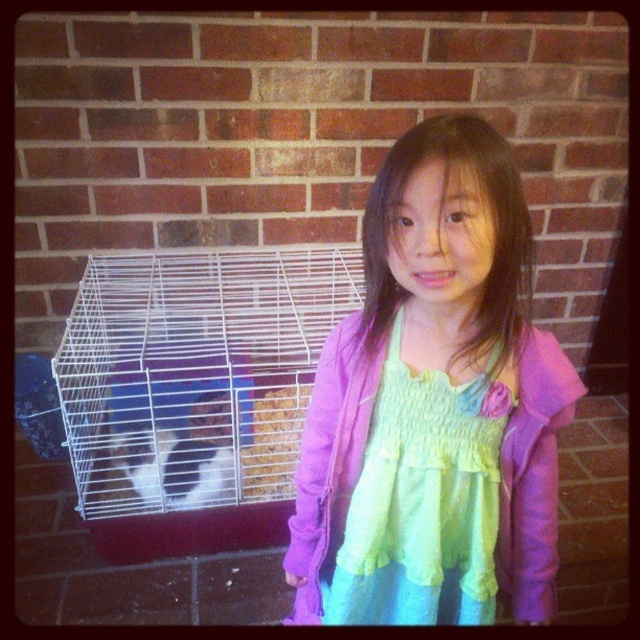
Question: Which point is closer to the camera taking this photo?

Choices:
 (A) (205, 304)
 (B) (196, 401)
 (C) (468, 458)
 (D) (547, 541)

Answer: (C)

Question: Can you confirm if purple satin dress at center is thinner than white wire birdcage at left?

Choices:
 (A) no
 (B) yes

Answer: (B)

Question: From the image, what is the correct spatial relationship of pastel chiffon dress at center in relation to white fur at center?

Choices:
 (A) above
 (B) below

Answer: (B)

Question: Which of the following is the closest to the observer?

Choices:
 (A) (504, 156)
 (B) (273, 381)
 (C) (227, 480)

Answer: (A)

Question: Does pastel chiffon dress at center appear under white fur at center?

Choices:
 (A) no
 (B) yes

Answer: (B)

Question: Estimate the real-world distances between objects in this image. Which object is farther from the purple satin dress at center?

Choices:
 (A) white wire birdcage at left
 (B) pastel chiffon dress at center
 (C) white fur at center

Answer: (C)